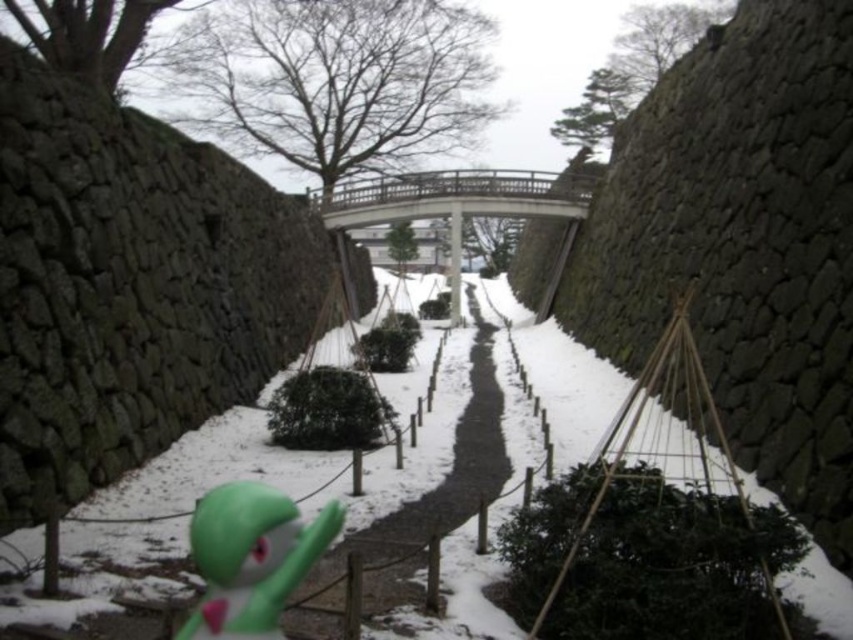
You are a small robot with a height of 10 cm. You need to navigate from the green rubber toy at lower left to the end of the snowy gravel path at center. Can you pass through the area between them without bending down?

The snowy gravel path at center is above the green rubber toy at lower left, meaning there is sufficient vertical clearance for the robot to move between them without needing to bend down since the path is elevated.

You are a small robot with a width of 30 cm. You are currently positioned at the edge of the snowy gravel path at center and want to move towards the green rubber toy at lower left. Is there enough space for you to navigate towards it without hitting the stone walls on either side?

The snowy gravel path at center is further to the viewer than the green rubber toy at lower left, so the robot would need to move forward towards the toy. However, the question does not provide information about the width of the path, so it is impossible to determine if there is enough space to navigate without hitting the stone walls on either side.

Consider the image. You are a hiker trying to navigate the snowy pathway. You see the snowy gravel path at center and the green rubber toy at lower left. Which object is located to the right of the other?

The snowy gravel path at center is positioned on the right side of green rubber toy at lower left, so the snowy gravel path at center is to the right of the green rubber toy at lower left.